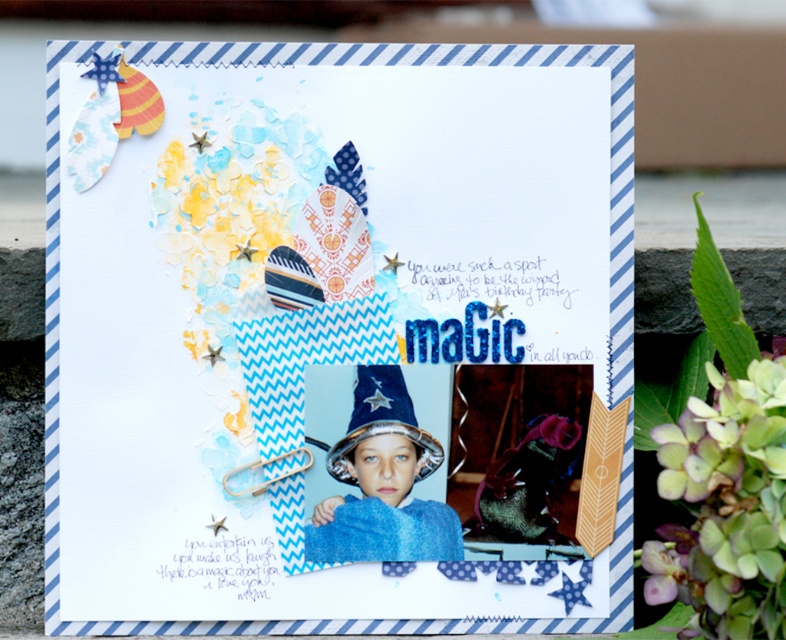
Question: From the image, what is the correct spatial relationship of green matte hydrangea at upper right in relation to shiny silver wizard hat at center?

Choices:
 (A) right
 (B) left

Answer: (A)

Question: Which object is farther from the camera taking this photo?

Choices:
 (A) matte blue wizard hat at center
 (B) shiny silver wizard hat at center
 (C) green matte hydrangea at upper right
 (D) blue felt wizard hat at center

Answer: (B)

Question: Considering the real-world distances, which object is farthest from the green matte hydrangea at upper right?

Choices:
 (A) shiny silver wizard hat at center
 (B) matte blue wizard hat at center
 (C) blue felt wizard hat at center

Answer: (A)

Question: Which of these objects is positioned closest to the matte blue wizard hat at center?

Choices:
 (A) shiny silver wizard hat at center
 (B) blue felt wizard hat at center

Answer: (B)

Question: Can you confirm if green matte hydrangea at upper right is positioned above shiny silver wizard hat at center?

Choices:
 (A) yes
 (B) no

Answer: (B)

Question: Does matte blue wizard hat at center appear on the left side of blue felt wizard hat at center?

Choices:
 (A) no
 (B) yes

Answer: (B)